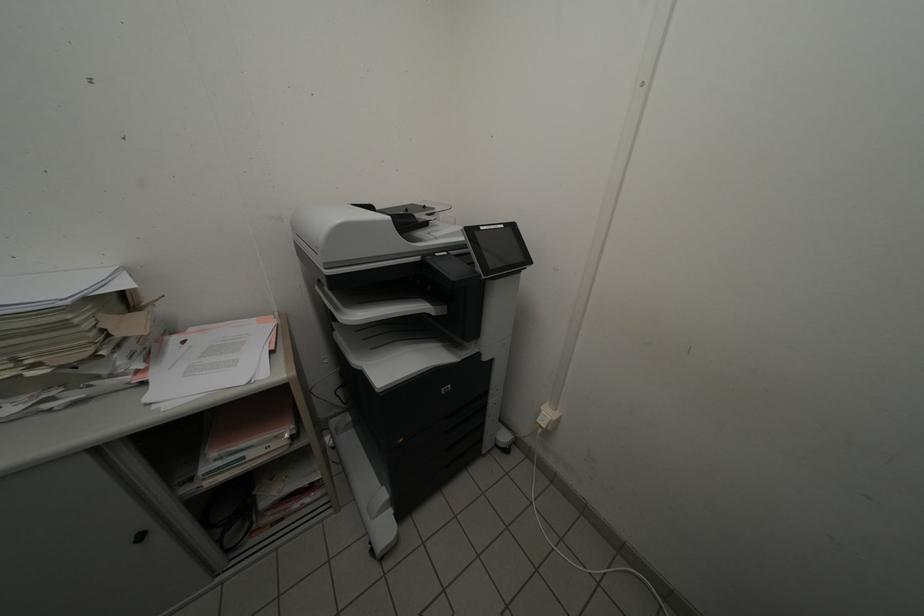
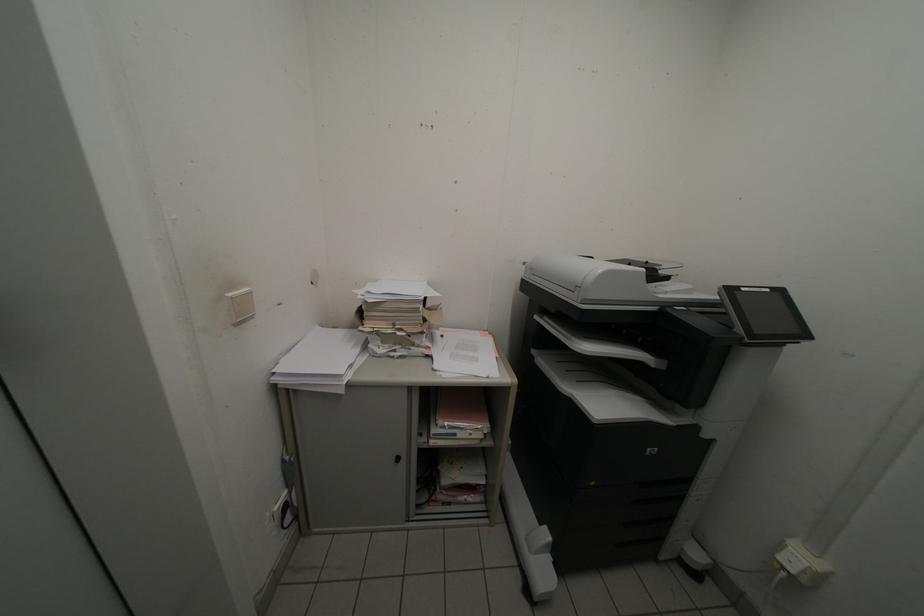
Question: The camera is either moving clockwise (left) or counter-clockwise (right) around the object. The first image is from the beginning of the video and the second image is from the end. Is the camera moving left or right when shooting the video?

Choices:
 (A) Left
 (B) Right

Answer: (B)